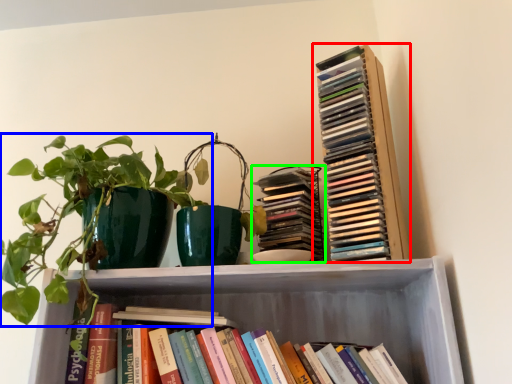
Question: Based on their relative distances, which object is farther from book (highlighted by a red box)? Choose from houseplant (highlighted by a blue box) and book (highlighted by a green box).

Choices:
 (A) houseplant
 (B) book

Answer: (A)